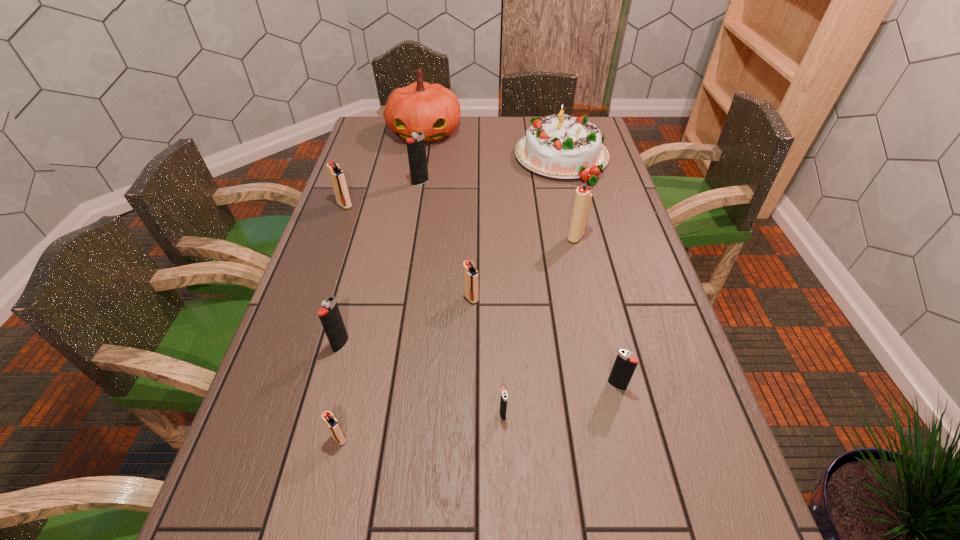
Find the location of a particular element. Image resolution: width=960 pixels, height=540 pixels. free point between the sixth nearest object and the cake is located at coordinates (569, 198).

Image resolution: width=960 pixels, height=540 pixels. In order to click on free space between the third red igniter from left to right and the farthest red igniter in this screenshot , I will do `click(408, 252)`.

Image resolution: width=960 pixels, height=540 pixels. Identify the location of vacant area that lies between the cake and the pumpkin. (493, 146).

Identify the location of free space between the smallest red igniter and the pink pumpkin. Image resolution: width=960 pixels, height=540 pixels. (382, 286).

The width and height of the screenshot is (960, 540). I want to click on free space between the nearest object and the sixth nearest object, so click(458, 338).

Image resolution: width=960 pixels, height=540 pixels. I want to click on free spot between the third red igniter from left to right and the rightmost red igniter, so click(523, 268).

The height and width of the screenshot is (540, 960). I want to click on unoccupied area between the farthest black igniter and the rightmost black igniter, so click(x=518, y=284).

I want to click on empty space between the sixth farthest igniter and the farthest red igniter, so click(x=481, y=295).

Identify which object is located as the nearest to the second black igniter from right to left. Please provide its 2D coordinates. Your answer should be formatted as a tuple, i.e. [(x, y)], where the tuple contains the x and y coordinates of a point satisfying the conditions above.

[(625, 364)]

This screenshot has height=540, width=960. In order to click on object that stands as the sixth closest to the sixth farthest igniter in this screenshot , I will do `click(562, 146)`.